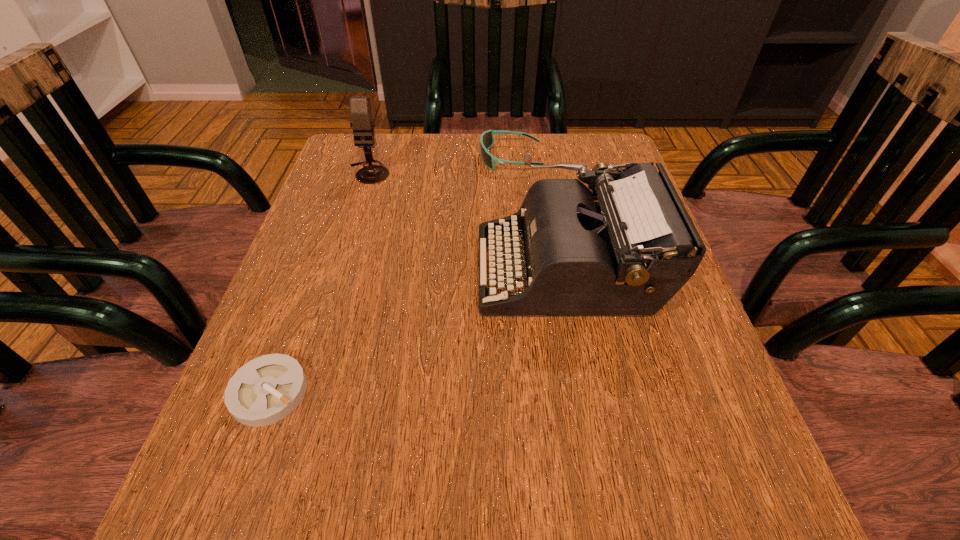
The height and width of the screenshot is (540, 960). I want to click on vacant space at the left edge of the desktop, so click(310, 273).

You are a GUI agent. You are given a task and a screenshot of the screen. Output one action in this format:
    pyautogui.click(x=<x>, y=<y>)
    Task: Click on the free region at the right edge of the desktop
    The width and height of the screenshot is (960, 540).
    Given the screenshot: What is the action you would take?
    pyautogui.click(x=618, y=321)

Where is `vacant space at the far left corner of the desktop`? This screenshot has width=960, height=540. vacant space at the far left corner of the desktop is located at coordinates (385, 151).

Where is `free region at the near left corner of the desktop`? Image resolution: width=960 pixels, height=540 pixels. free region at the near left corner of the desktop is located at coordinates (273, 529).

The width and height of the screenshot is (960, 540). I want to click on free spot between the shortest object and the third tallest object, so click(x=390, y=275).

At what (x,y) coordinates should I click in order to perform the action: click on free space between the second shortest object and the microphone. Please return your answer as a coordinate pair (x, y). Looking at the image, I should click on (440, 165).

Where is `vacant point located between the ashtray and the microphone`? vacant point located between the ashtray and the microphone is located at coordinates (319, 282).

This screenshot has height=540, width=960. Find the location of `free area in between the microphone and the third tallest object`. free area in between the microphone and the third tallest object is located at coordinates (440, 165).

Image resolution: width=960 pixels, height=540 pixels. I want to click on vacant space that's between the nearest object and the sunglasses, so click(390, 275).

Locate an element on the screen. vacant area between the second nearest object and the nearest object is located at coordinates (419, 330).